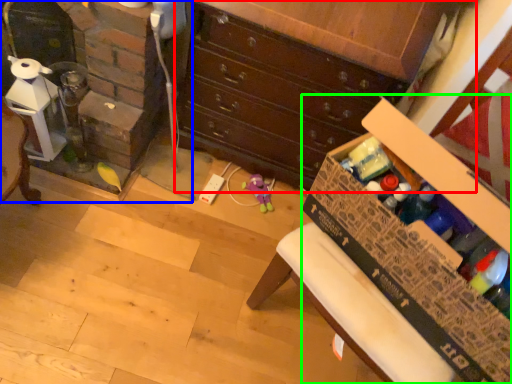
Question: Based on their relative distances, which object is farther from chest of drawers (highlighted by a red box)? Choose from fireplace (highlighted by a blue box) and cardboard box (highlighted by a green box).

Choices:
 (A) fireplace
 (B) cardboard box

Answer: (B)